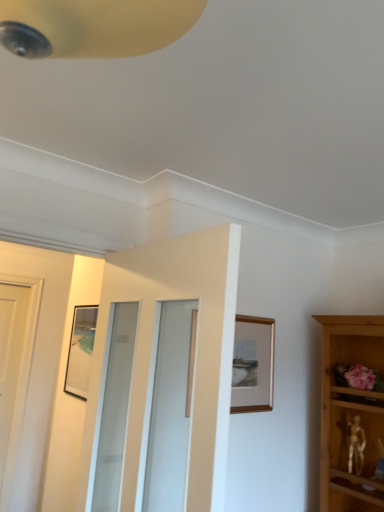
Question: Can you confirm if white glossy door at center is taller than wooden picture frame at upper center?

Choices:
 (A) yes
 (B) no

Answer: (A)

Question: Considering the relative positions of white glossy door at center and wooden picture frame at upper center in the image provided, is white glossy door at center behind wooden picture frame at upper center?

Choices:
 (A) yes
 (B) no

Answer: (B)

Question: Does white glossy door at center have a lesser width compared to wooden picture frame at upper center?

Choices:
 (A) no
 (B) yes

Answer: (A)

Question: From the image's perspective, is white glossy door at center on wooden picture frame at upper center?

Choices:
 (A) no
 (B) yes

Answer: (B)

Question: Can you confirm if white glossy door at center is positioned to the right of wooden picture frame at upper center?

Choices:
 (A) no
 (B) yes

Answer: (A)

Question: Considering the relative sizes of white glossy door at center and wooden picture frame at upper center in the image provided, is white glossy door at center smaller than wooden picture frame at upper center?

Choices:
 (A) no
 (B) yes

Answer: (A)

Question: From the image's perspective, is wooden picture frame at upper center located beneath white glossy door at center?

Choices:
 (A) yes
 (B) no

Answer: (A)

Question: Is wooden picture frame at upper center to the left of white glossy door at center from the viewer's perspective?

Choices:
 (A) no
 (B) yes

Answer: (A)

Question: Is wooden picture frame at upper center closer to camera compared to white glossy door at center?

Choices:
 (A) no
 (B) yes

Answer: (A)

Question: Can you confirm if wooden picture frame at upper center is taller than white glossy door at center?

Choices:
 (A) no
 (B) yes

Answer: (A)

Question: From the image's perspective, is wooden picture frame at upper center on top of white glossy door at center?

Choices:
 (A) yes
 (B) no

Answer: (B)

Question: Is wooden picture frame at upper center at the right side of white glossy door at center?

Choices:
 (A) yes
 (B) no

Answer: (A)

Question: Which is correct: wooden picture frame at upper center is inside white glossy door at center, or outside of it?

Choices:
 (A) outside
 (B) inside

Answer: (A)